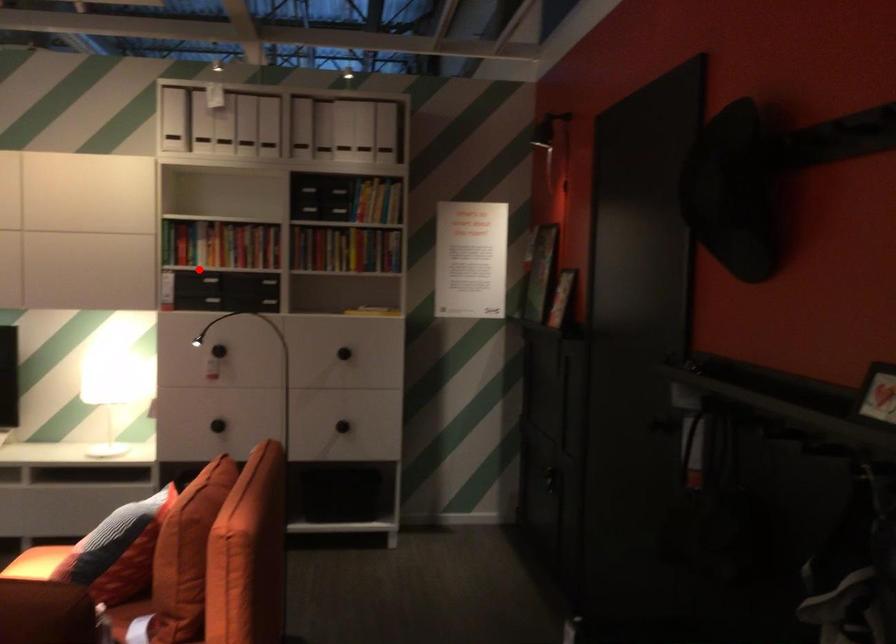
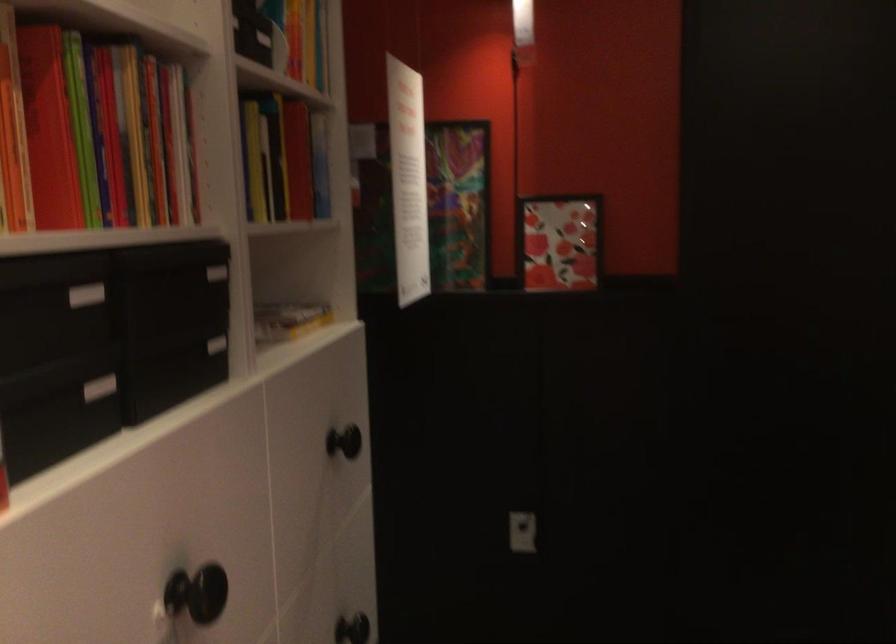
Question: I am providing you with two images of the same scene from different viewpoints. In image1, a red point is highlighted. Considering the same 3D point in image2, which of the following is correct?

Choices:
 (A) It is closer
 (B) It is farther

Answer: (A)